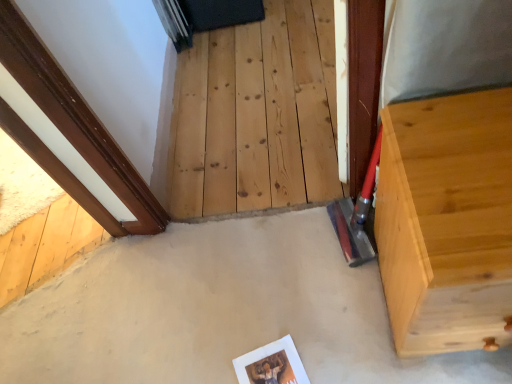
Locate an element on the screen. natural wood stairwell at center is located at coordinates (257, 114).

In order to face smooth concrete at center, should I rotate leftwards or rightwards?

You should rotate left by 6.549 degrees.

Identify the location of light wood dresser at right. point(447,222).

The height and width of the screenshot is (384, 512). What do you see at coordinates (447, 222) in the screenshot?
I see `light wood dresser at right` at bounding box center [447, 222].

The height and width of the screenshot is (384, 512). In order to click on natural wood stairwell at center in this screenshot , I will do point(257,114).

Is light wood dresser at right smaller than natural wood stairwell at center?

No.

Can we say light wood dresser at right lies outside natural wood stairwell at center?

Yes.

From the image's perspective, which is above, light wood dresser at right or natural wood stairwell at center?

natural wood stairwell at center, from the image's perspective.

Considering the relative sizes of smooth concrete at center and natural wood stairwell at center in the image provided, is smooth concrete at center shorter than natural wood stairwell at center?

Correct, smooth concrete at center is not as tall as natural wood stairwell at center.

Between smooth concrete at center and natural wood stairwell at center, which one is positioned in front?

smooth concrete at center is in front.

Is natural wood stairwell at center a part of smooth concrete at center?

No, natural wood stairwell at center is not a part of smooth concrete at center.

Looking at the image, does smooth concrete at center seem bigger or smaller compared to natural wood stairwell at center?

Clearly, smooth concrete at center is larger in size than natural wood stairwell at center.

Locate an element on the screen. furniture that is in front of the natural wood stairwell at center is located at coordinates (447, 222).

What's the angular difference between natural wood stairwell at center and light wood dresser at right's facing directions?

They differ by 0.715 degrees in their facing directions.

Considering the sizes of objects natural wood stairwell at center and light wood dresser at right in the image provided, who is wider, natural wood stairwell at center or light wood dresser at right?

With larger width is natural wood stairwell at center.

Can you confirm if smooth concrete at center is taller than light wood dresser at right?

No, smooth concrete at center is not taller than light wood dresser at right.

Which is correct: smooth concrete at center is inside light wood dresser at right, or outside of it?

smooth concrete at center is spatially situated outside light wood dresser at right.

In the scene shown: Considering the relative positions of smooth concrete at center and light wood dresser at right in the image provided, is smooth concrete at center to the right of light wood dresser at right from the viewer's perspective?

No, smooth concrete at center is not to the right of light wood dresser at right.

Considering the positions of objects smooth concrete at center and light wood dresser at right in the image provided, who is in front, smooth concrete at center or light wood dresser at right?

light wood dresser at right is in front.

Is natural wood stairwell at center with smooth concrete at center?

No, natural wood stairwell at center is not touching smooth concrete at center.

Is natural wood stairwell at center facing towards smooth concrete at center?

Yes, natural wood stairwell at center faces towards smooth concrete at center.

From the image's perspective, which one is positioned lower, natural wood stairwell at center or smooth concrete at center?

smooth concrete at center appears lower in the image.

Is natural wood stairwell at center inside or outside of smooth concrete at center?

natural wood stairwell at center is not inside smooth concrete at center, it's outside.

Could you tell me if light wood dresser at right is facing smooth concrete at center?

No.

Which point is more distant from viewer, [384,164] or [360,267]?

The point [360,267] is farther.

In the scene shown: From a real-world perspective, is light wood dresser at right under smooth concrete at center?

Actually, light wood dresser at right is physically above smooth concrete at center in the real world.

Identify the location of stairwell on the left of light wood dresser at right. (257, 114).

In the image, there is a natural wood stairwell at center. What are the coordinates of `concrete below it (from the image's perspective)` in the screenshot? It's located at (219, 311).

From the image, which object appears to be farther from smooth concrete at center, natural wood stairwell at center or light wood dresser at right?

light wood dresser at right is positioned further to the anchor smooth concrete at center.

Looking at this image, from the image, which object appears to be farther from natural wood stairwell at center, smooth concrete at center or light wood dresser at right?

light wood dresser at right.

Considering their positions, is light wood dresser at right positioned further to natural wood stairwell at center than smooth concrete at center?

The object further to natural wood stairwell at center is light wood dresser at right.

Which object lies nearer to the anchor point light wood dresser at right, smooth concrete at center or natural wood stairwell at center?

The object closer to light wood dresser at right is smooth concrete at center.

Estimate the real-world distances between objects in this image. Which object is further from light wood dresser at right, natural wood stairwell at center or smooth concrete at center?

natural wood stairwell at center is further to light wood dresser at right.

Looking at the image, which one is located closer to smooth concrete at center, light wood dresser at right or natural wood stairwell at center?

Among the two, natural wood stairwell at center is located nearer to smooth concrete at center.

The width and height of the screenshot is (512, 384). I want to click on concrete between light wood dresser at right and natural wood stairwell at center along the z-axis, so click(x=219, y=311).